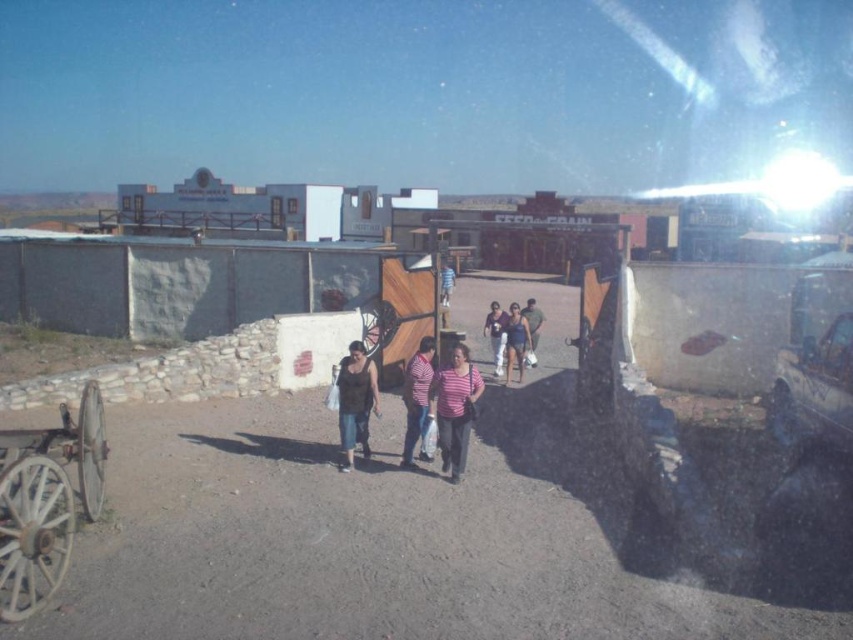
Question: Can you confirm if striped fabric shirt at center is bigger than blue striped shirt at center?

Choices:
 (A) no
 (B) yes

Answer: (A)

Question: Which point is farther from the camera taking this photo?

Choices:
 (A) (508, 324)
 (B) (461, 436)
 (C) (71, 429)
 (D) (529, 316)

Answer: (D)

Question: Can you confirm if rusty metal wagon at lower left is positioned to the right of green fabric shirt at center?

Choices:
 (A) yes
 (B) no

Answer: (B)

Question: Which point is farther to the camera?

Choices:
 (A) (416, 356)
 (B) (445, 275)
 (C) (3, 557)
 (D) (363, 387)

Answer: (B)

Question: Can you confirm if green fabric shirt at center is positioned above blue striped shirt at center?

Choices:
 (A) no
 (B) yes

Answer: (A)

Question: Which object appears closest to the camera in this image?

Choices:
 (A) pink fabric shirt at center
 (B) matte black shirt at center

Answer: (B)